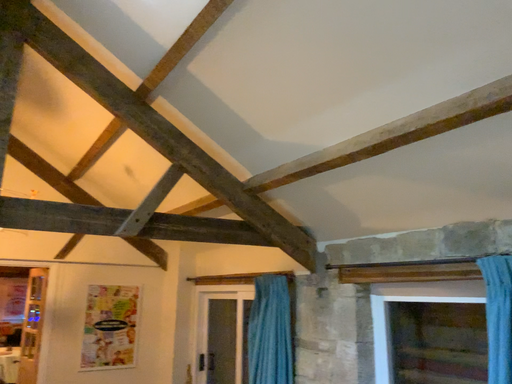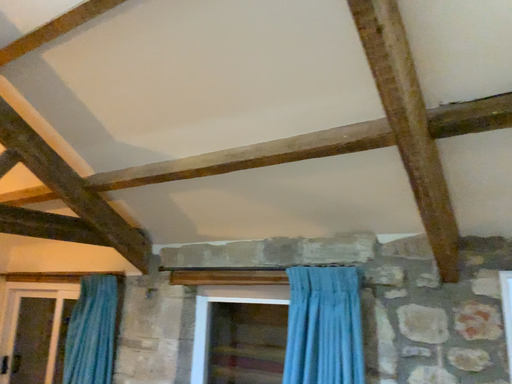
Question: How did the camera likely rotate when shooting the video?

Choices:
 (A) rotated right
 (B) rotated left

Answer: (A)